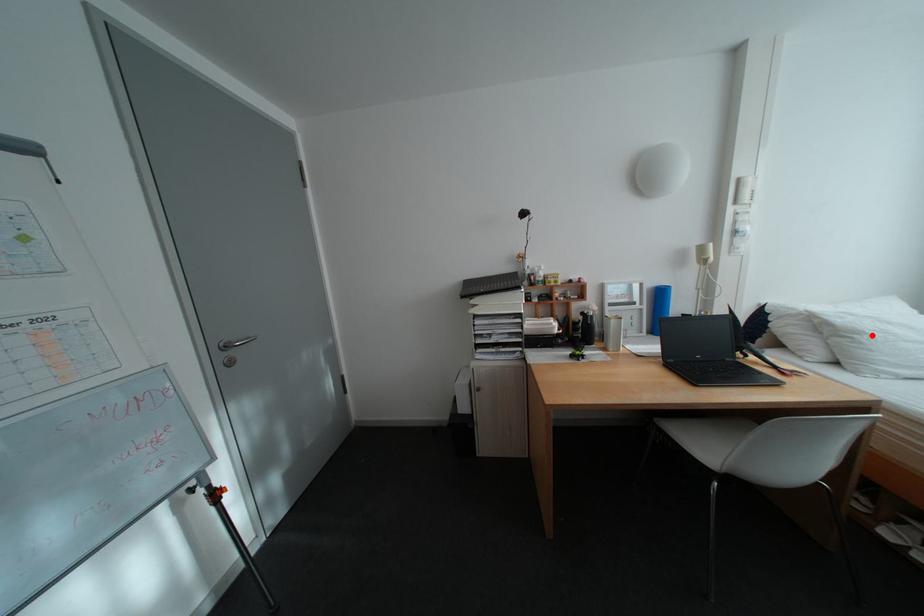
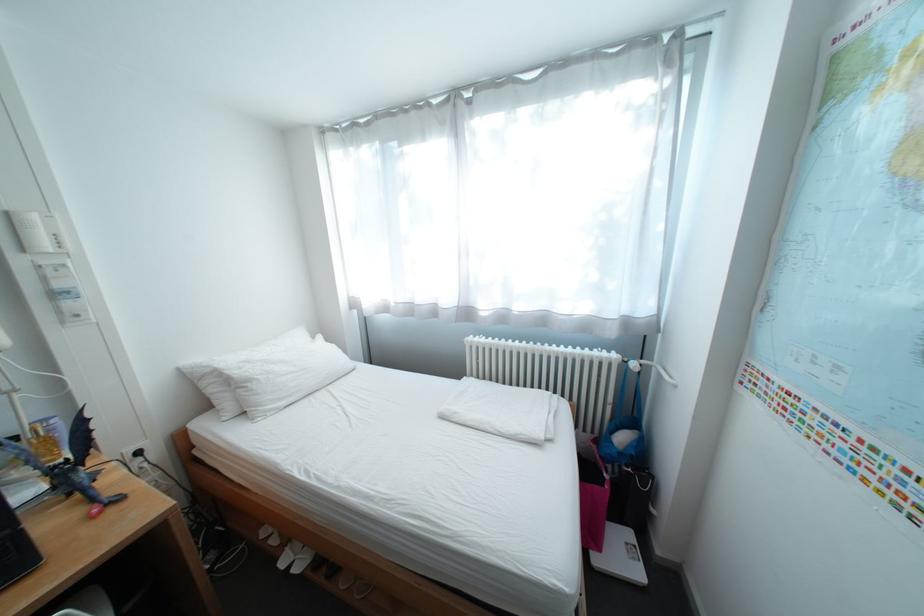
Where in the second image is the point corresponding to the highlighted location from the first image?

(263, 383)